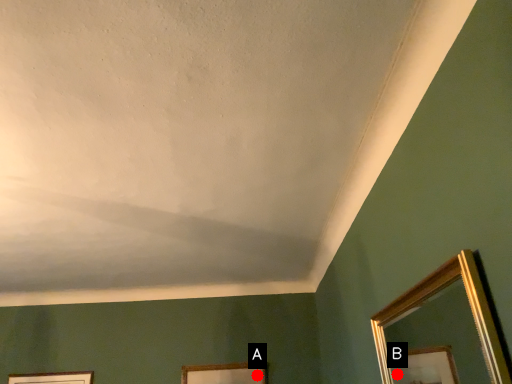
Question: Two points are circled on the image, labeled by A and B beside each circle. Among these points, which one is farthest from the camera?

Choices:
 (A) A is further
 (B) B is further

Answer: (B)